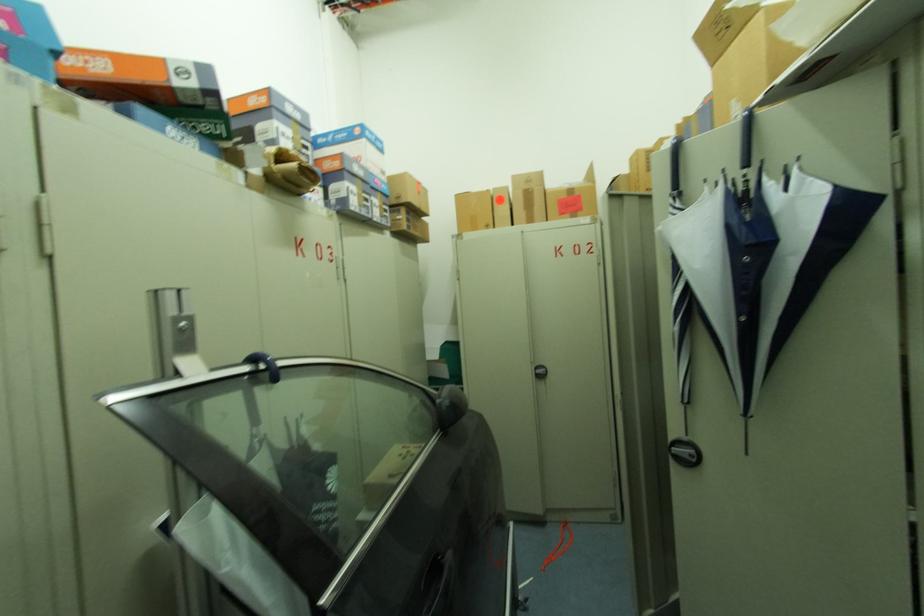
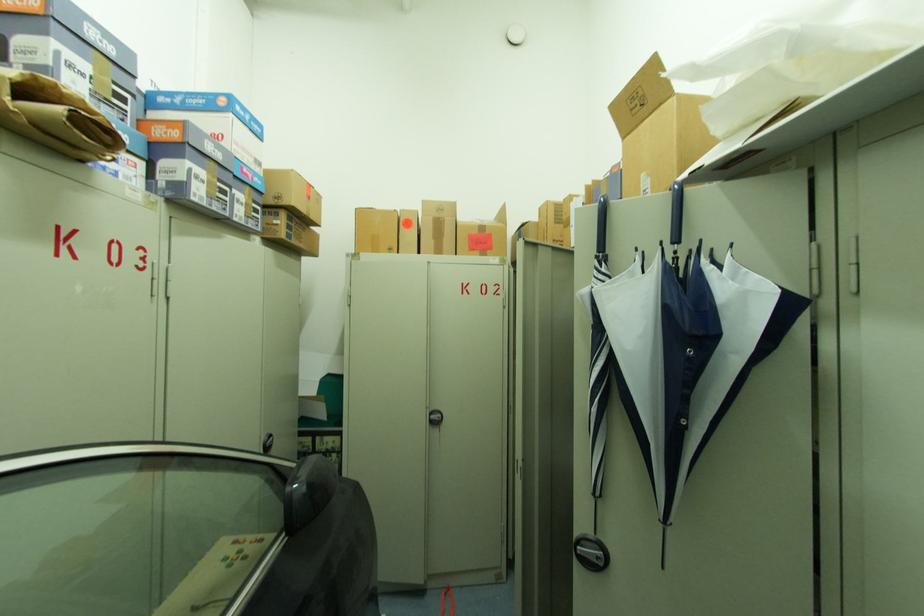
Question: The images are taken continuously from a first-person perspective. In which direction are you moving?

Choices:
 (A) Left
 (B) Right
 (C) Forward
 (D) Backward

Answer: (C)